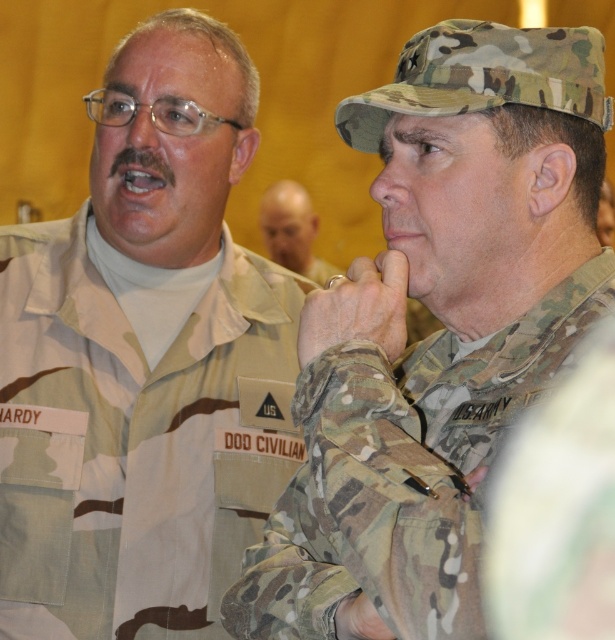
You are a photographer trying to capture a clear photo of the smooth bald head at center. However, the matte camouflage glove at center is blocking your view. Can you adjust your position to take the photo without the glove obstructing the head?

The matte camouflage glove at center is behind the smooth bald head at center, so you can take the photo from the front without the glove obstructing the head.

Based on the scene description, where is the smooth bald head at center located?

The smooth bald head at center is located at point coordinates of approximately 0.361 on the x axis and 0.476 on the y axis.